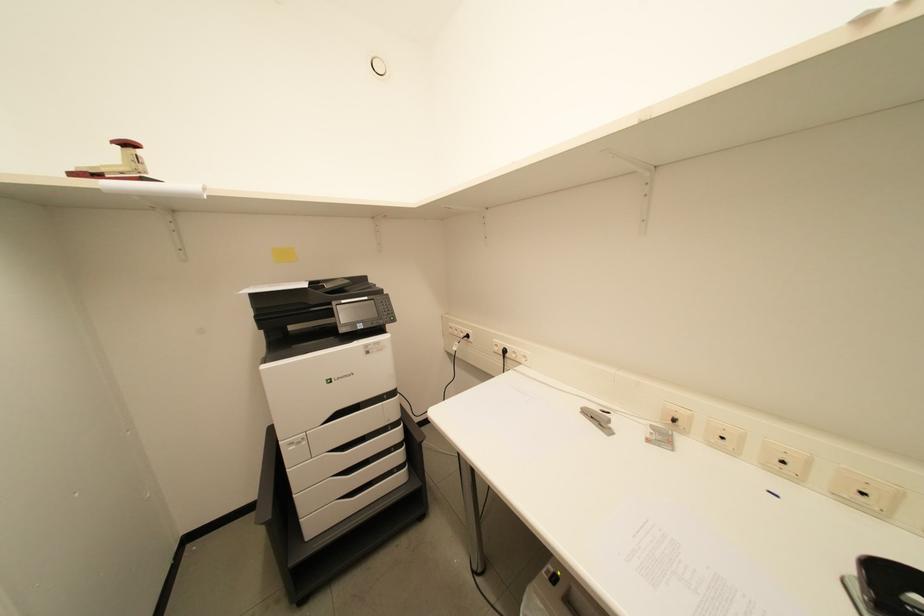
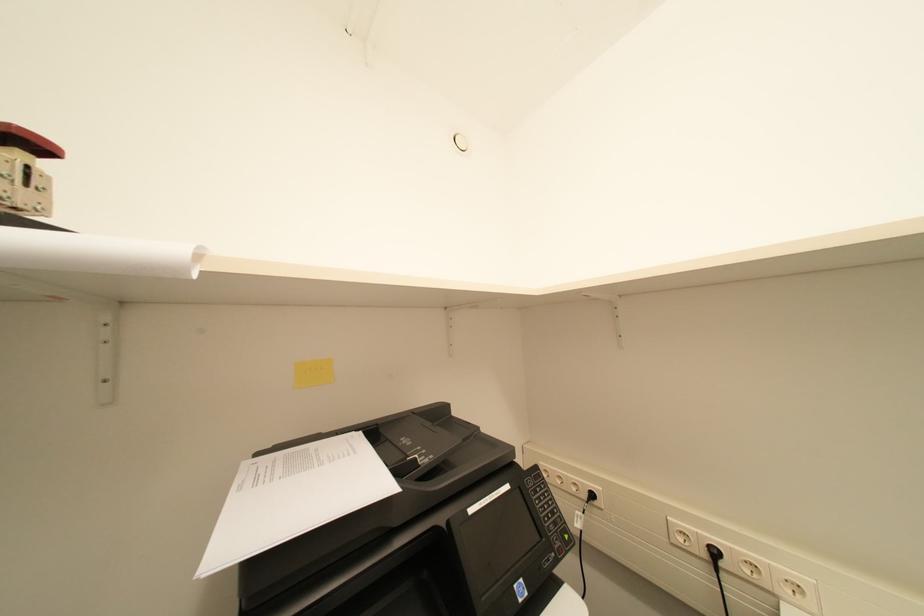
What movement of the cameraman would produce the second image?

The cameraman walked toward left, forward.